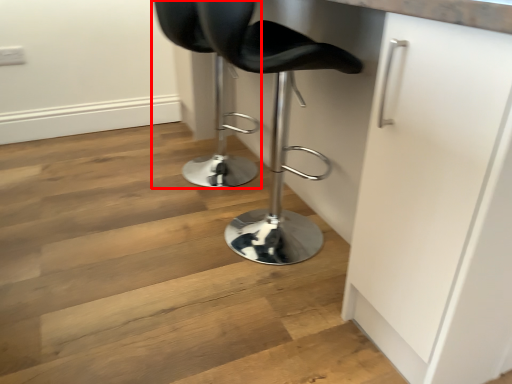
Question: From the image's perspective, where is chair (annotated by the red box) located in relation to chair in the image?

Choices:
 (A) below
 (B) above

Answer: (B)